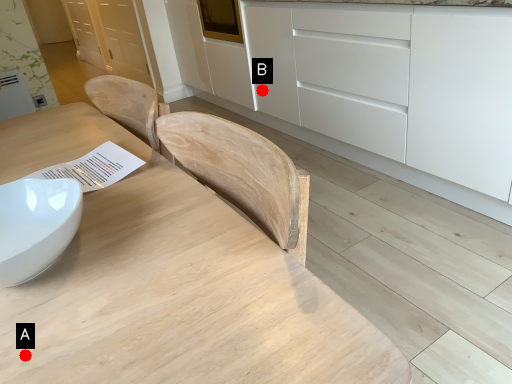
Question: Two points are circled on the image, labeled by A and B beside each circle. Which of the following is the closest to the observer?

Choices:
 (A) A is closer
 (B) B is closer

Answer: (A)